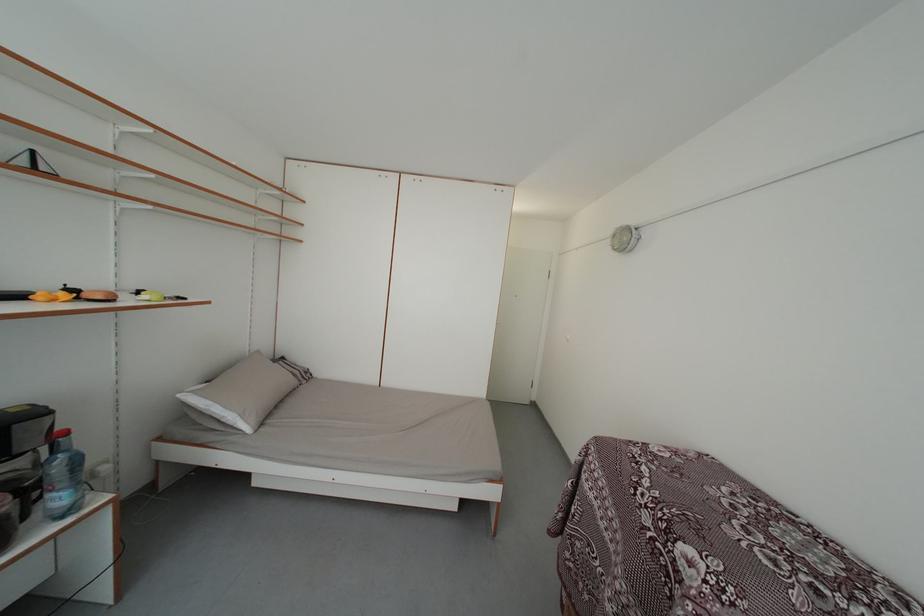
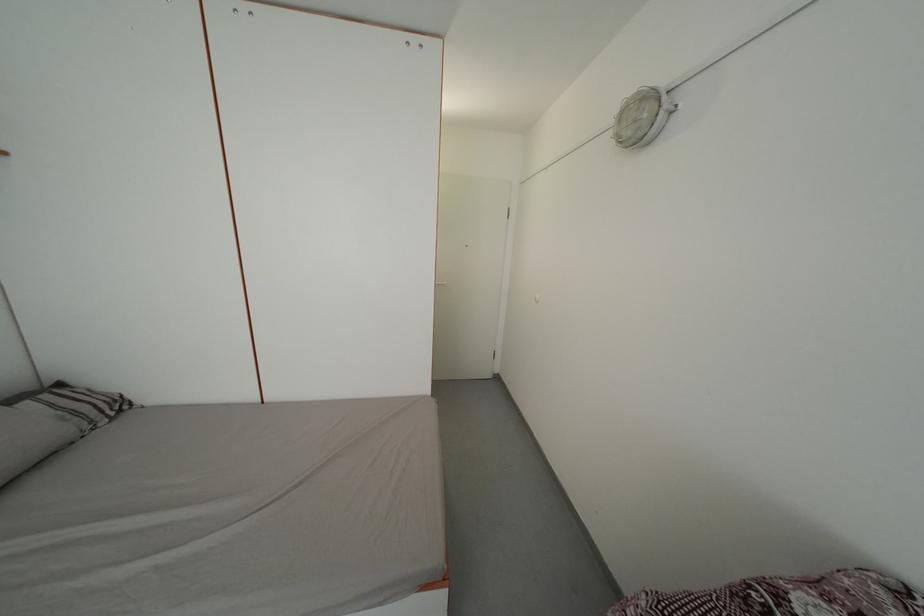
Question: The images are taken continuously from a first-person perspective. In which direction are you moving?

Choices:
 (A) Left
 (B) Right
 (C) Forward
 (D) Backward

Answer: (C)